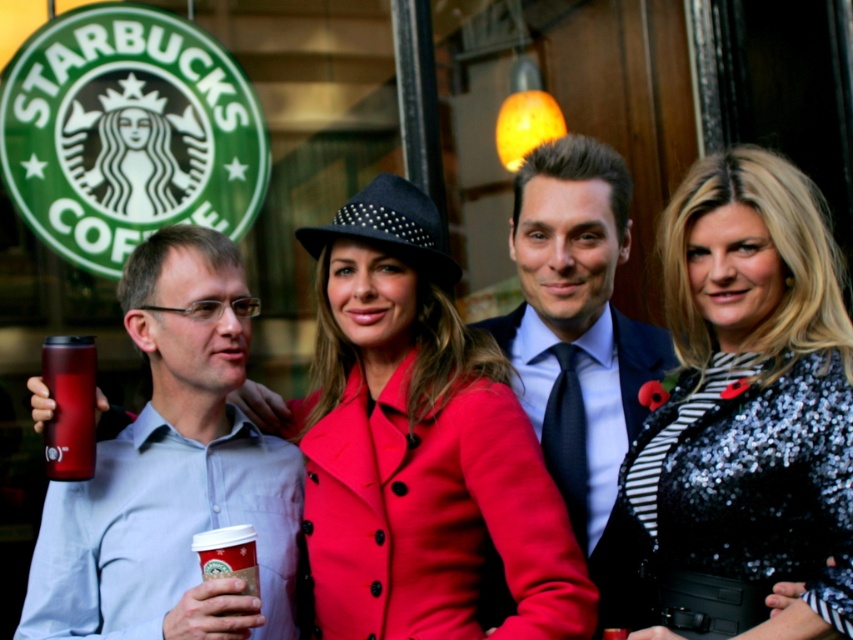
This screenshot has height=640, width=853. What do you see at coordinates (579, 346) in the screenshot?
I see `shiny blue suit at center` at bounding box center [579, 346].

Who is taller, shiny blue suit at center or cardboard cup at center?

shiny blue suit at center is taller.

What do you see at coordinates (579, 346) in the screenshot? This screenshot has width=853, height=640. I see `shiny blue suit at center` at bounding box center [579, 346].

You are a GUI agent. You are given a task and a screenshot of the screen. Output one action in this format:
    pyautogui.click(x=<x>, y=<y>)
    Task: Click on the shiny blue suit at center
    
    Given the screenshot: What is the action you would take?
    pyautogui.click(x=579, y=346)

Is point (148, 474) behind point (231, 532)?

Yes, it is behind point (231, 532).

Can you confirm if matte plastic cup at left is thinner than cardboard cup at center?

Incorrect, matte plastic cup at left's width is not less than cardboard cup at center's.

Which is in front, point (207, 444) or point (247, 531)?

Point (247, 531) is more forward.

Locate an element on the screen. The width and height of the screenshot is (853, 640). matte plastic cup at left is located at coordinates (173, 472).

Which is below, sequined black dress at center or shiny blue suit at center?

shiny blue suit at center

Is point (676, 632) closer to camera compared to point (607, 394)?

That is True.

At what (x,y) coordinates should I click in order to perform the action: click on sequined black dress at center. Please return your answer as a coordinate pair (x, y). Looking at the image, I should click on (747, 412).